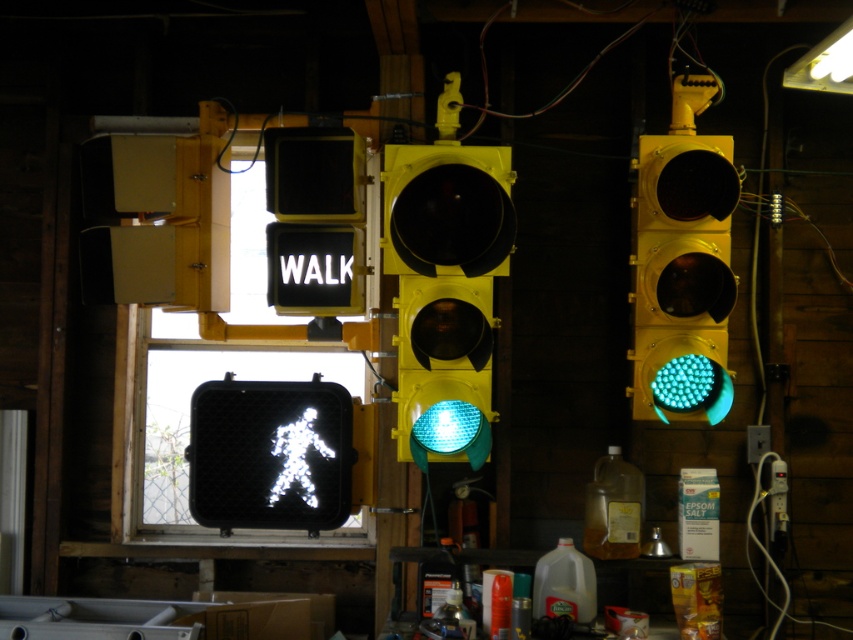
You are a technician inspecting the traffic lights in the workshop. You notice the green matte traffic light at right and the white plastic traffic light at upper left. Which one is closer to you?

The green matte traffic light at right is closer to you because it is in front of the white plastic traffic light at upper left.

You are standing in front of the traffic lights in the workshop. You want to place a sticker on the traffic light that is closer to you. Which point should you choose between point (85, 193) and point (276, 256)?

Point (276, 256) is closer to you, so you should choose point (276, 256) to place the sticker.

You are a technician checking the traffic lights in the workshop. You need to adjust the spacing between the green matte traffic light at right and the white plastic traffic light at upper left to ensure they are evenly spaced. Which traffic light should you move to the right to achieve this?

The green matte traffic light at right has a lesser width compared to the white plastic traffic light at upper left. To evenly space them, you should move the green matte traffic light at right to the right side so that both traffic lights occupy the same amount of space.